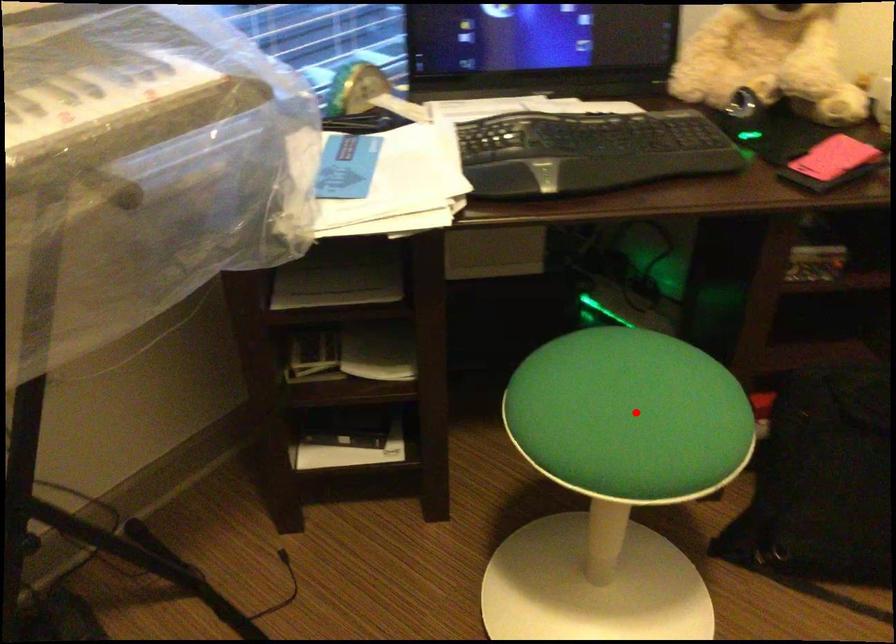
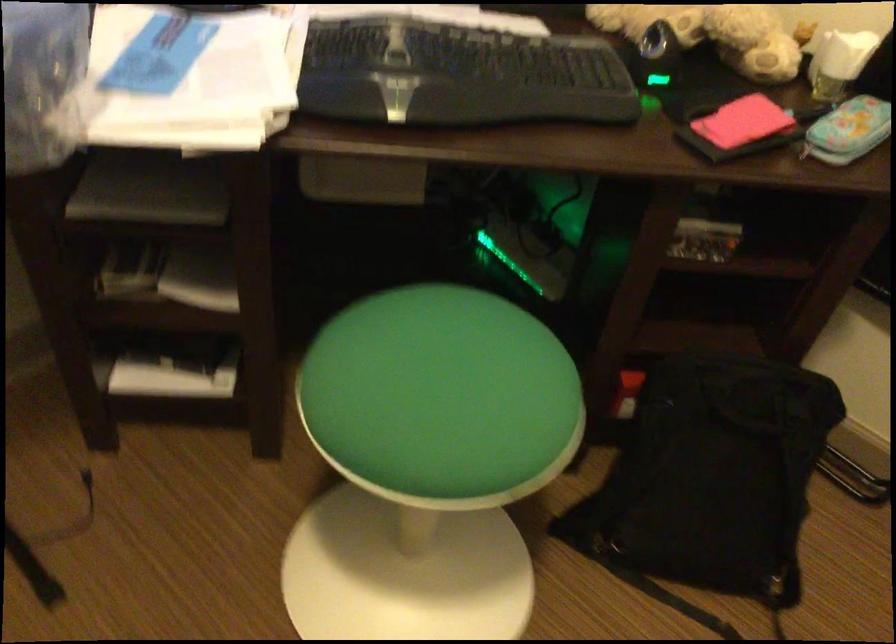
Question: I am providing you with two images of the same scene from different viewpoints. In image1, a red point is highlighted. Considering the same 3D point in image2, which of the following is correct?

Choices:
 (A) It is closer
 (B) It is farther

Answer: (A)